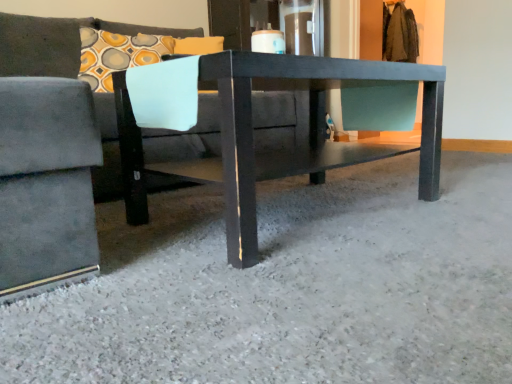
Question: Considering the relative sizes of velvet gray couch at center and smooth gray carpet at center in the image provided, is velvet gray couch at center wider than smooth gray carpet at center?

Choices:
 (A) yes
 (B) no

Answer: (B)

Question: Is velvet gray couch at center aimed at smooth gray carpet at center?

Choices:
 (A) yes
 (B) no

Answer: (A)

Question: Is velvet gray couch at center to the right of smooth gray carpet at center from the viewer's perspective?

Choices:
 (A) yes
 (B) no

Answer: (B)

Question: Is smooth gray carpet at center located within velvet gray couch at center?

Choices:
 (A) yes
 (B) no

Answer: (B)

Question: From a real-world perspective, is velvet gray couch at center beneath smooth gray carpet at center?

Choices:
 (A) no
 (B) yes

Answer: (A)

Question: Is point (317, 92) closer or farther from the camera than point (288, 304)?

Choices:
 (A) farther
 (B) closer

Answer: (A)

Question: Considering the positions of matte black table at center and smooth gray carpet at center in the image, is matte black table at center wider or thinner than smooth gray carpet at center?

Choices:
 (A) wide
 (B) thin

Answer: (B)

Question: Do you think matte black table at center is within smooth gray carpet at center, or outside of it?

Choices:
 (A) inside
 (B) outside

Answer: (B)

Question: Would you say matte black table at center is to the left or to the right of smooth gray carpet at center in the picture?

Choices:
 (A) right
 (B) left

Answer: (B)

Question: Considering the positions of smooth gray carpet at center and velvet gray couch at center in the image, is smooth gray carpet at center taller or shorter than velvet gray couch at center?

Choices:
 (A) short
 (B) tall

Answer: (A)

Question: Is smooth gray carpet at center to the left or to the right of velvet gray couch at center in the image?

Choices:
 (A) right
 (B) left

Answer: (A)

Question: From a real-world perspective, is smooth gray carpet at center positioned above or below velvet gray couch at center?

Choices:
 (A) above
 (B) below

Answer: (B)

Question: In terms of width, does smooth gray carpet at center look wider or thinner when compared to velvet gray couch at center?

Choices:
 (A) wide
 (B) thin

Answer: (A)

Question: Is point (75, 104) closer or farther from the camera than point (344, 165)?

Choices:
 (A) closer
 (B) farther

Answer: (A)

Question: Considering the relative positions of velvet gray couch at center and matte black table at center in the image provided, is velvet gray couch at center to the left or to the right of matte black table at center?

Choices:
 (A) left
 (B) right

Answer: (A)